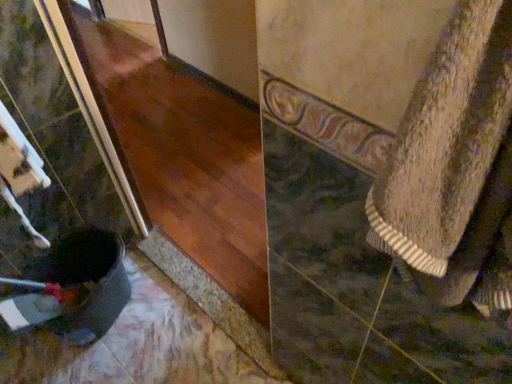
Question: Considering the positions of point (224, 254) and point (471, 163), is point (224, 254) closer or farther from the camera than point (471, 163)?

Choices:
 (A) farther
 (B) closer

Answer: (A)

Question: In terms of size, does glossy wood at lower left appear bigger or smaller than textured beige towel at right?

Choices:
 (A) small
 (B) big

Answer: (B)

Question: From the image's perspective, is glossy wood at lower left located above or below textured beige towel at right?

Choices:
 (A) above
 (B) below

Answer: (A)

Question: From the image's perspective, is textured beige towel at right above or below glossy wood at lower left?

Choices:
 (A) above
 (B) below

Answer: (B)

Question: Based on their sizes in the image, would you say textured beige towel at right is bigger or smaller than glossy wood at lower left?

Choices:
 (A) big
 (B) small

Answer: (B)

Question: Considering their positions, is textured beige towel at right located in front of or behind glossy wood at lower left?

Choices:
 (A) front
 (B) behind

Answer: (A)

Question: Is textured beige towel at right to the left or to the right of glossy wood at lower left in the image?

Choices:
 (A) left
 (B) right

Answer: (B)